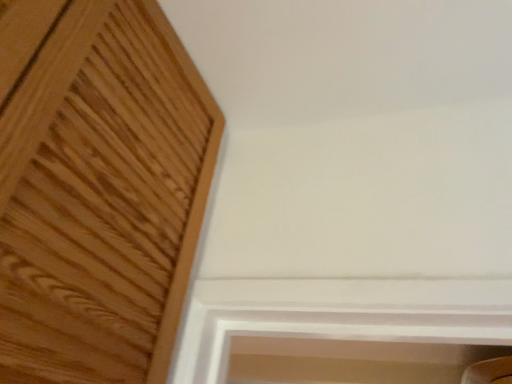
Find the location of a particular element. This screenshot has width=512, height=384. natural wood paneling at left is located at coordinates (99, 192).

The image size is (512, 384). Describe the element at coordinates (99, 192) in the screenshot. I see `natural wood paneling at left` at that location.

Locate an element on the screen. This screenshot has height=384, width=512. natural wood paneling at left is located at coordinates (99, 192).